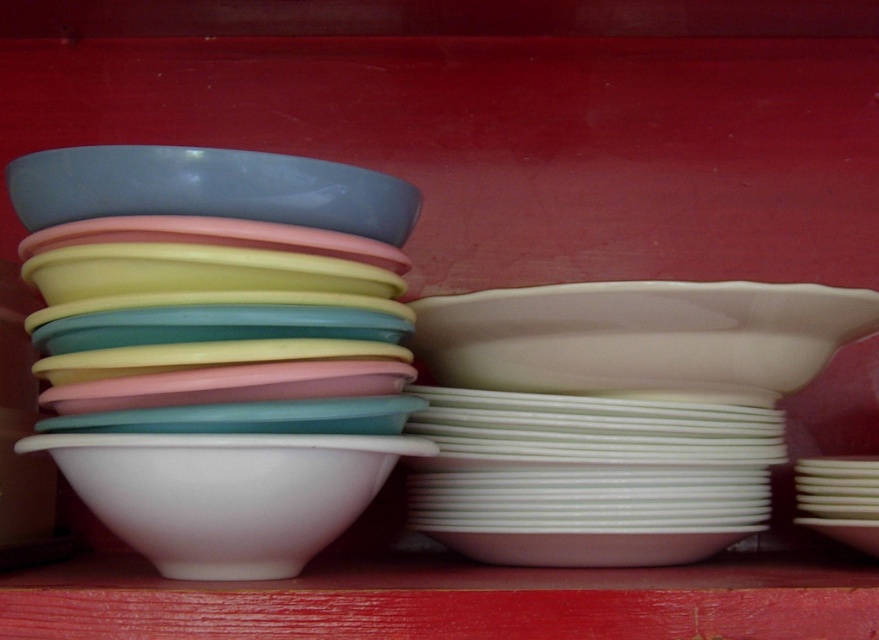
Identify the location of white glossy bowl at right. (641, 337).

Locate an element on the screen. Image resolution: width=879 pixels, height=640 pixels. white glossy bowl at right is located at coordinates (641, 337).

Does white glossy bowl at center have a greater height compared to matte blue bowl at upper left?

Yes, white glossy bowl at center is taller than matte blue bowl at upper left.

Who is taller, white glossy bowl at center or matte blue bowl at upper left?

Standing taller between the two is white glossy bowl at center.

At what (x,y) coordinates should I click in order to perform the action: click on white glossy bowl at center. Please return your answer as a coordinate pair (x, y). This screenshot has height=640, width=879. Looking at the image, I should click on (224, 493).

Locate an element on the screen. Image resolution: width=879 pixels, height=640 pixels. white glossy bowl at right is located at coordinates (641, 337).

Between point (787, 384) and point (158, 456), which one is positioned in front?

Positioned in front is point (158, 456).

Locate an element on the screen. This screenshot has width=879, height=640. white glossy bowl at right is located at coordinates (641, 337).

I want to click on white glossy bowl at right, so click(641, 337).